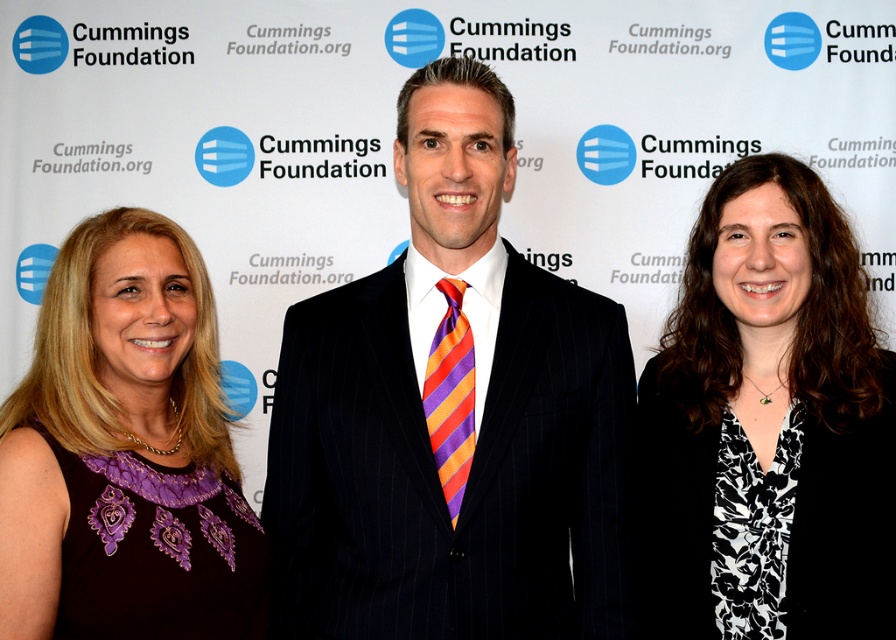
Question: Which point is farther from the camera taking this photo?

Choices:
 (A) (699, 298)
 (B) (448, 282)

Answer: (A)

Question: Which object appears closest to the camera in this image?

Choices:
 (A) black floral dress at right
 (B) black pinstripe suit at center
 (C) purple embroidered dress at left

Answer: (C)

Question: Does black floral dress at right appear on the right side of purple embroidered dress at left?

Choices:
 (A) yes
 (B) no

Answer: (A)

Question: Observing the image, what is the correct spatial positioning of black floral dress at right in reference to purple embroidered dress at left?

Choices:
 (A) right
 (B) left

Answer: (A)

Question: Which point appears farthest from the camera in this image?

Choices:
 (A) (50, 381)
 (B) (605, 340)

Answer: (B)

Question: Observing the image, what is the correct spatial positioning of black pinstripe suit at center in reference to orange and purple striped tie at center?

Choices:
 (A) below
 (B) above

Answer: (B)